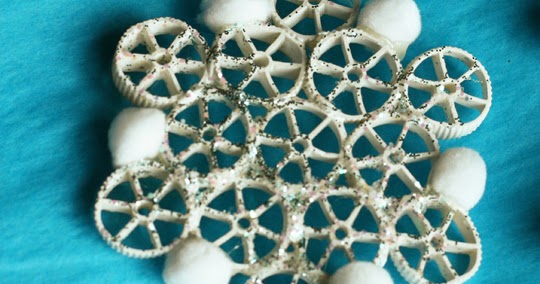
You are a GUI agent. You are given a task and a screenshot of the screen. Output one action in this format:
    pyautogui.click(x=<x>, y=<y>)
    Task: Click on the empty space to left of central item
    
    Given the screenshot: What is the action you would take?
    pyautogui.click(x=43, y=28), pyautogui.click(x=44, y=250)